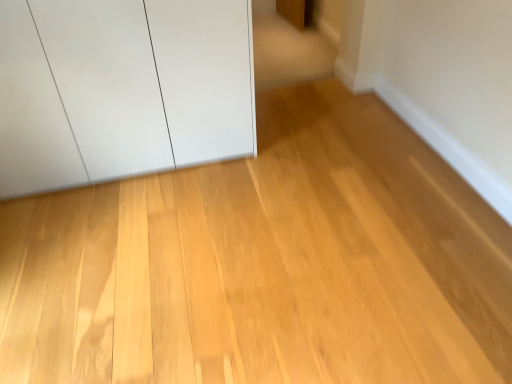
Locate an element on the screen. white matte cupboard at upper left is located at coordinates (121, 89).

Measure the distance between point (2,141) and camera.

Point (2,141) is 7.17 feet away from camera.

Image resolution: width=512 pixels, height=384 pixels. What do you see at coordinates (121, 89) in the screenshot?
I see `white matte cupboard at upper left` at bounding box center [121, 89].

This screenshot has width=512, height=384. In order to click on white matte cupboard at upper left in this screenshot , I will do `click(121, 89)`.